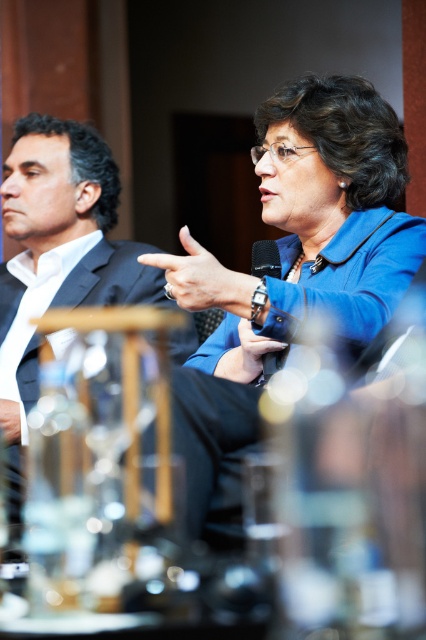
Does blue fabric jacket at center have a larger size compared to black suit at left?

Actually, blue fabric jacket at center might be smaller than black suit at left.

Is blue fabric jacket at center to the right of black suit at left from the viewer's perspective?

Correct, you'll find blue fabric jacket at center to the right of black suit at left.

Does point (287, 220) come behind point (0, 284)?

No.

The image size is (426, 640). Identify the location of blue fabric jacket at center. (310, 225).

Does black suit at left appear under black matte microphone at center?

Yes.

Is black suit at left wider than black matte microphone at center?

Yes, black suit at left is wider than black matte microphone at center.

At what (x,y) coordinates should I click in order to perform the action: click on black suit at left. Please return your answer as a coordinate pair (x, y). This screenshot has width=426, height=640. Looking at the image, I should click on (57, 253).

What are the coordinates of `blue fabric jacket at center` in the screenshot? It's located at (310, 225).

At what (x,y) coordinates should I click in order to perform the action: click on blue fabric jacket at center. Please return your answer as a coordinate pair (x, y). Image resolution: width=426 pixels, height=640 pixels. Looking at the image, I should click on (310, 225).

The width and height of the screenshot is (426, 640). Identify the location of blue fabric jacket at center. (310, 225).